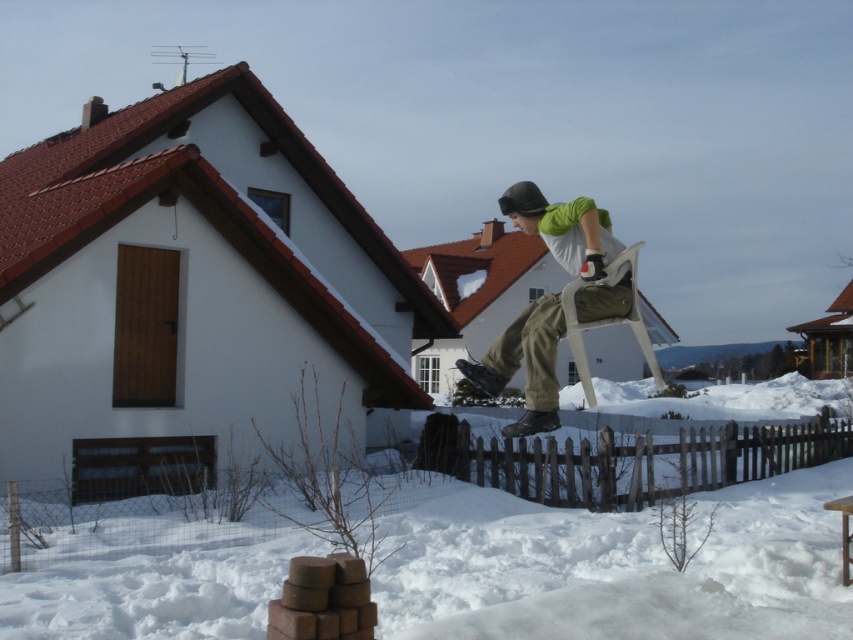
Does brown wooden fence at lower center have a larger size compared to matte green shirt at center?

No, brown wooden fence at lower center is not bigger than matte green shirt at center.

Which is in front, point (740, 449) or point (534, 326)?

Point (534, 326) is in front.

You are a GUI agent. You are given a task and a screenshot of the screen. Output one action in this format:
    pyautogui.click(x=<x>, y=<y>)
    Task: Click on the brown wooden fence at lower center
    The image size is (853, 640).
    Given the screenshot: What is the action you would take?
    pyautogui.click(x=640, y=460)